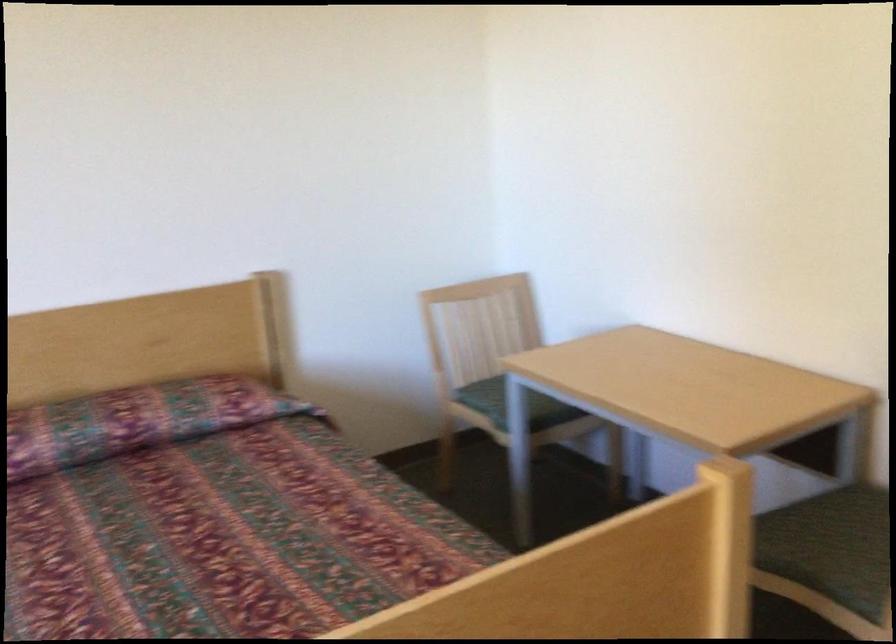
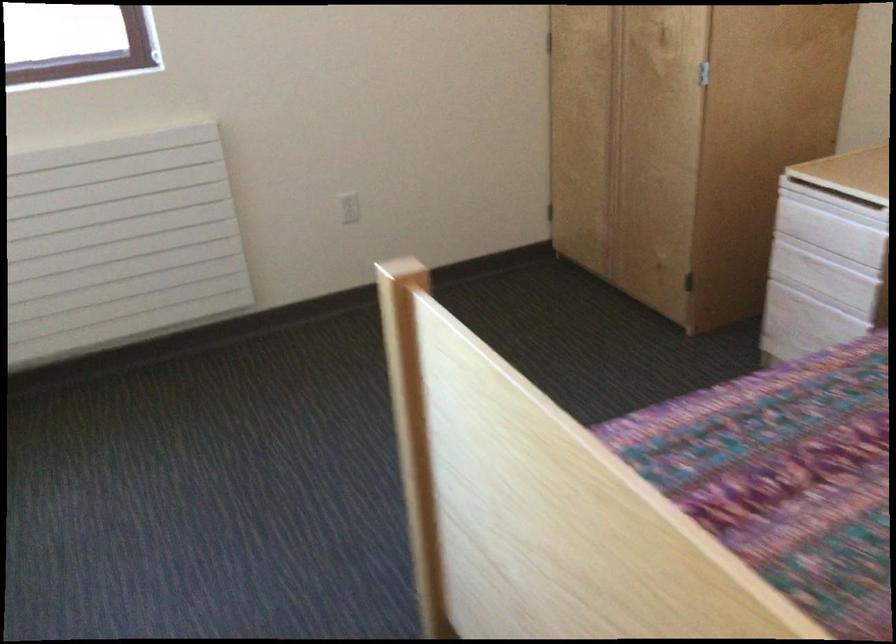
The first image is from the beginning of the video and the second image is from the end. How did the camera likely rotate when shooting the video?

The camera's rotation is toward left-down.